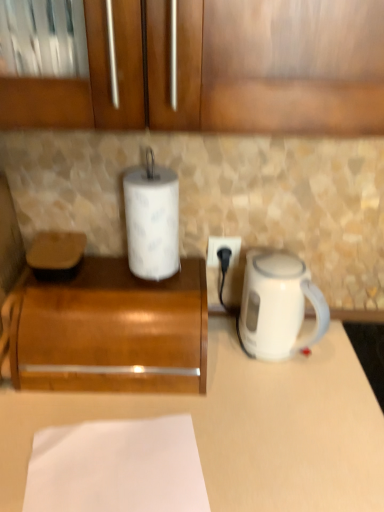
Question: From a real-world perspective, is wooden at left on top of white paper at lower center?

Choices:
 (A) yes
 (B) no

Answer: (A)

Question: Does wooden at left have a greater width compared to white paper at lower center?

Choices:
 (A) yes
 (B) no

Answer: (A)

Question: Does wooden at left contain white paper at lower center?

Choices:
 (A) no
 (B) yes

Answer: (A)

Question: Is wooden at left at the right side of white paper at lower center?

Choices:
 (A) no
 (B) yes

Answer: (A)

Question: Does wooden at left come in front of white paper at lower center?

Choices:
 (A) no
 (B) yes

Answer: (A)

Question: Considering the relative sizes of wooden at left and white paper at lower center in the image provided, is wooden at left shorter than white paper at lower center?

Choices:
 (A) no
 (B) yes

Answer: (A)

Question: Is wooden at left further to camera compared to white plastic power outlet at center?

Choices:
 (A) yes
 (B) no

Answer: (B)

Question: Is wooden at left closer to the viewer compared to white plastic power outlet at center?

Choices:
 (A) no
 (B) yes

Answer: (B)

Question: Considering the relative sizes of wooden at left and white plastic power outlet at center in the image provided, is wooden at left smaller than white plastic power outlet at center?

Choices:
 (A) yes
 (B) no

Answer: (B)

Question: From a real-world perspective, is wooden at left below white plastic power outlet at center?

Choices:
 (A) no
 (B) yes

Answer: (B)

Question: From the image's perspective, is wooden at left beneath white plastic power outlet at center?

Choices:
 (A) no
 (B) yes

Answer: (B)

Question: Is wooden at left outside white plastic power outlet at center?

Choices:
 (A) no
 (B) yes

Answer: (B)

Question: Does white paper at lower center touch white matte counter at center?

Choices:
 (A) no
 (B) yes

Answer: (A)